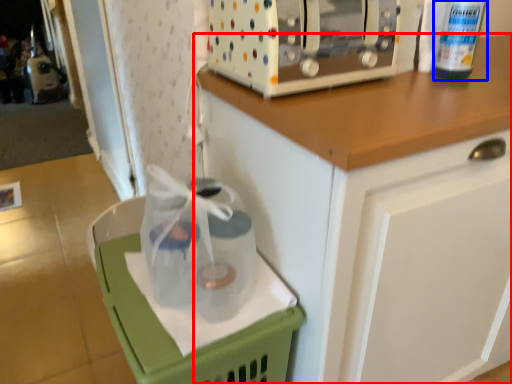
Question: Which object appears closest to the camera in this image, cabinetry (highlighted by a red box) or bottle (highlighted by a blue box)?

Choices:
 (A) cabinetry
 (B) bottle

Answer: (A)